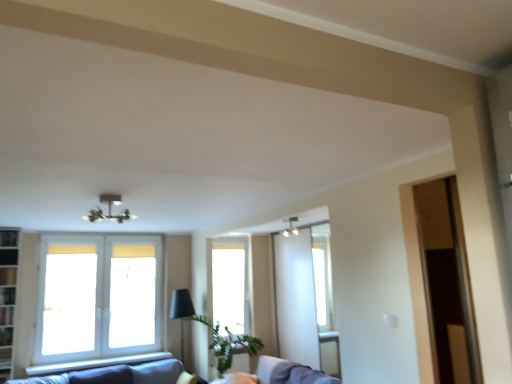
This screenshot has width=512, height=384. I want to click on transparent glass window at center, acting as the 1th window starting from the back, so click(230, 285).

Identify the location of black matte shelf at left. (8, 256).

Could you tell me if black matte shelf at left is turned towards transparent glass window at center, placed as the second window when sorted from left to right?

No, black matte shelf at left is not aimed at transparent glass window at center, placed as the second window when sorted from left to right.

Consider the image. Can you confirm if black matte shelf at left is bigger than transparent glass window at center, acting as the 1th window starting from the back?

No.

Is black matte shelf at left thinner than transparent glass window at center, placed as the second window when sorted from left to right?

Yes, black matte shelf at left is thinner than transparent glass window at center, placed as the second window when sorted from left to right.

Is black matte shelf at left far away from transparent glass window at center, acting as the 1th window starting from the back?

That's right, there is a large distance between black matte shelf at left and transparent glass window at center, acting as the 1th window starting from the back.

Are dark gray fabric couch at lower left and white glass window at left, which is the 1th window from front to back, located far from each other?

Result: No, there isn't a large distance between dark gray fabric couch at lower left and white glass window at left, which is the 1th window from front to back.

Could you tell me if dark gray fabric couch at lower left is turned towards white glass window at left, which is counted as the 2th window, starting from the right?

No, dark gray fabric couch at lower left is not oriented towards white glass window at left, which is counted as the 2th window, starting from the right.

Considering the relative positions of dark gray fabric couch at lower left and white glass window at left, marked as the first window in a left-to-right arrangement, in the image provided, is dark gray fabric couch at lower left to the left or to the right of white glass window at left, marked as the first window in a left-to-right arrangement,?

In the image, dark gray fabric couch at lower left appears on the right side of white glass window at left, marked as the first window in a left-to-right arrangement.

I want to click on studio couch below the white glass window at left, which is counted as the 2th window, starting from the right (from the image's perspective), so click(106, 376).

This screenshot has height=384, width=512. Identify the location of shelf that is above the dark gray fabric couch at lower left (from a real-world perspective). (8, 256).

From a real-world perspective, is dark gray fabric couch at lower left under black matte shelf at left?

Yes.

Considering the sizes of objects dark gray fabric couch at lower left and black matte shelf at left in the image provided, who is smaller, dark gray fabric couch at lower left or black matte shelf at left?

Smaller between the two is black matte shelf at left.

Can you confirm if dark gray fabric couch at lower left is taller than black matte shelf at left?

Indeed, dark gray fabric couch at lower left has a greater height compared to black matte shelf at left.

Considering the relative positions of metallic chandelier at upper center and transparent glass window at center, placed as the second window when sorted from left to right, in the image provided, is metallic chandelier at upper center behind transparent glass window at center, placed as the second window when sorted from left to right,?

No, the depth of metallic chandelier at upper center is less than that of transparent glass window at center, placed as the second window when sorted from left to right.

You are a GUI agent. You are given a task and a screenshot of the screen. Output one action in this format:
    pyautogui.click(x=<x>, y=<y>)
    Task: Click on the 2nd window below the metallic chandelier at upper center (from the image's perspective)
    
    Given the screenshot: What is the action you would take?
    pyautogui.click(x=230, y=285)

Considering the relative positions of metallic chandelier at upper center and transparent glass window at center, the second window from the front, in the image provided, is metallic chandelier at upper center to the left or to the right of transparent glass window at center, the second window from the front,?

metallic chandelier at upper center is positioned on transparent glass window at center, the second window from the front,'s left side.

Who is smaller, white glass window at left, marked as the first window in a left-to-right arrangement, or black matte shelf at left?

With smaller size is black matte shelf at left.

Where is `shelf in front of the white glass window at left, which is counted as the 2th window, starting from the right`? shelf in front of the white glass window at left, which is counted as the 2th window, starting from the right is located at coordinates (8, 256).

Are white glass window at left, marked as the first window in a left-to-right arrangement, and black matte shelf at left located far from each other?

Yes, white glass window at left, marked as the first window in a left-to-right arrangement, and black matte shelf at left are quite far apart.

Considering the relative sizes of metallic chandelier at upper center and white fabric swivel chair at lower center in the image provided, is metallic chandelier at upper center wider than white fabric swivel chair at lower center?

Incorrect, the width of metallic chandelier at upper center does not surpass that of white fabric swivel chair at lower center.

Is metallic chandelier at upper center completely or partially outside of white fabric swivel chair at lower center?

Yes, metallic chandelier at upper center is outside of white fabric swivel chair at lower center.

Consider the image. From the image's perspective, who appears lower, metallic chandelier at upper center or white fabric swivel chair at lower center?

white fabric swivel chair at lower center, from the image's perspective.

Find the location of `light fixture in front of the white fabric swivel chair at lower center`. light fixture in front of the white fabric swivel chair at lower center is located at coordinates (109, 210).

Can you confirm if white fabric swivel chair at lower center is positioned to the right of metallic chandelier at upper center?

Indeed, white fabric swivel chair at lower center is positioned on the right side of metallic chandelier at upper center.

From a real-world perspective, does white fabric swivel chair at lower center sit lower than metallic chandelier at upper center?

Yes, from a real-world perspective, white fabric swivel chair at lower center is beneath metallic chandelier at upper center.

Where is `the 2nd window to the right when counting from the black matte shelf at left`? The image size is (512, 384). the 2nd window to the right when counting from the black matte shelf at left is located at coordinates (230, 285).

The width and height of the screenshot is (512, 384). Identify the location of the 1st window behind the dark gray fabric couch at lower left, counting from the anchor's position. (97, 297).

From the image, which object appears to be farther from black matte shelf at left, transparent glass window at center, placed as the second window when sorted from left to right, or white fabric swivel chair at lower center?

Among the two, white fabric swivel chair at lower center is located further to black matte shelf at left.

When comparing their distances from metallic chandelier at upper center, does white fabric swivel chair at lower center or white glass window at left, which ranks as the second window in back-to-front order, seem closer?

white glass window at left, which ranks as the second window in back-to-front order, is positioned closer to the anchor metallic chandelier at upper center.

Estimate the real-world distances between objects in this image. Which object is closer to black matte shelf at left, transparent glass window at center, acting as the 1th window starting from the back, or metallic chandelier at upper center?

Based on the image, metallic chandelier at upper center appears to be nearer to black matte shelf at left.

Which object lies further to the anchor point dark gray fabric couch at lower left, metallic chandelier at upper center or white glass window at left, marked as the first window in a left-to-right arrangement?

metallic chandelier at upper center lies further to dark gray fabric couch at lower left than the other object.

From the image, which object appears to be nearer to white glass window at left, marked as the first window in a left-to-right arrangement, dark gray fabric couch at lower left or metallic chandelier at upper center?

The object closer to white glass window at left, marked as the first window in a left-to-right arrangement, is dark gray fabric couch at lower left.

Based on their spatial positions, is white glass window at left, which is counted as the 2th window, starting from the right, or metallic chandelier at upper center further from white fabric swivel chair at lower center?

metallic chandelier at upper center.

When comparing their distances from transparent glass window at center, placed as the second window when sorted from left to right, does white glass window at left, which is counted as the 2th window, starting from the right, or dark gray fabric couch at lower left seem closer?

white glass window at left, which is counted as the 2th window, starting from the right, is closer to transparent glass window at center, placed as the second window when sorted from left to right.

Based on their spatial positions, is white glass window at left, marked as the first window in a left-to-right arrangement, or metallic chandelier at upper center closer to black matte shelf at left?

white glass window at left, marked as the first window in a left-to-right arrangement, is closer to black matte shelf at left.

Identify the location of swivel chair between metallic chandelier at upper center and dark gray fabric couch at lower left in the vertical direction. This screenshot has height=384, width=512. (279, 374).

The width and height of the screenshot is (512, 384). I want to click on window between white fabric swivel chair at lower center and transparent glass window at center, acting as the 1th window starting from the back, from front to back, so click(97, 297).

What are the coordinates of `shelf between metallic chandelier at upper center and dark gray fabric couch at lower left in the vertical direction` in the screenshot? It's located at (8, 256).

Identify the location of shelf between dark gray fabric couch at lower left and white glass window at left, which is counted as the 2th window, starting from the right, along the z-axis. (8, 256).